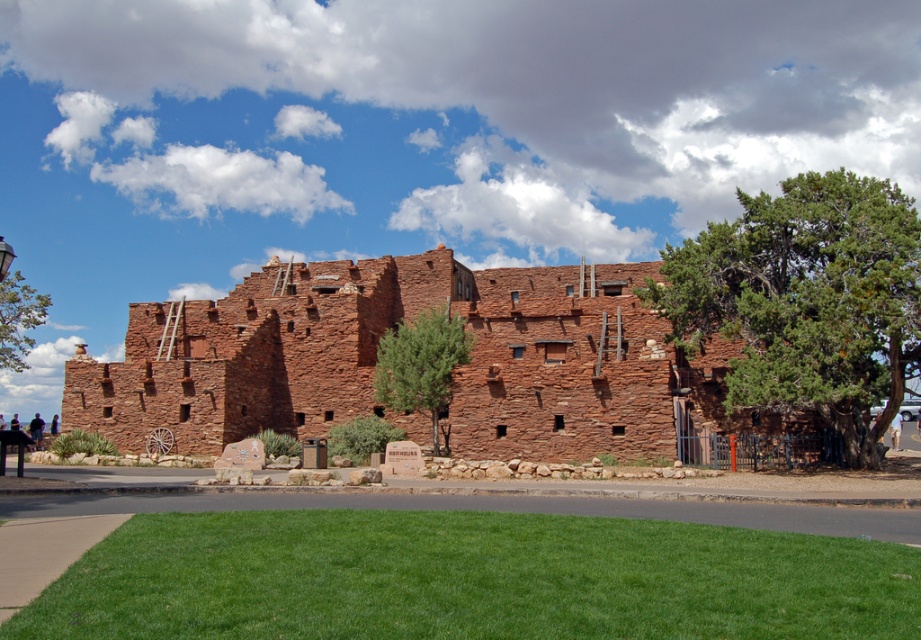
Is green asphalt at lower center smaller than green textured tree at center?

Correct, green asphalt at lower center occupies less space than green textured tree at center.

Is green asphalt at lower center to the left of green textured tree at center from the viewer's perspective?

In fact, green asphalt at lower center is to the right of green textured tree at center.

You are a GUI agent. You are given a task and a screenshot of the screen. Output one action in this format:
    pyautogui.click(x=<x>, y=<y>)
    Task: Click on the green asphalt at lower center
    
    Given the screenshot: What is the action you would take?
    pyautogui.click(x=499, y=508)

Based on the photo, is reddish-brown stone ruins at center positioned at the back of dark brown leather jacket at lower left?

No, it is not.

Is reddish-brown stone ruins at center below dark brown leather jacket at lower left?

No, reddish-brown stone ruins at center is not below dark brown leather jacket at lower left.

Identify the location of reddish-brown stone ruins at center. click(x=376, y=356).

Image resolution: width=921 pixels, height=640 pixels. What are the coordinates of `reddish-brown stone ruins at center` in the screenshot? It's located at (376, 356).

Which of these two, reddish-brown stone ruins at center or green leafy tree at left, stands shorter?

reddish-brown stone ruins at center

Consider the image. Can you confirm if reddish-brown stone ruins at center is positioned to the right of green leafy tree at left?

Correct, you'll find reddish-brown stone ruins at center to the right of green leafy tree at left.

Describe the element at coordinates (376, 356) in the screenshot. I see `reddish-brown stone ruins at center` at that location.

Where is `reddish-brown stone ruins at center`? reddish-brown stone ruins at center is located at coordinates (376, 356).